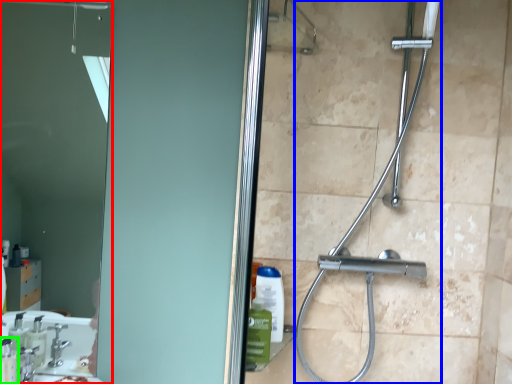
Question: Which object is positioned closest to mirror (highlighted by a red box)? Select from shower (highlighted by a blue box) and soap dispenser (highlighted by a green box).

Choices:
 (A) shower
 (B) soap dispenser

Answer: (B)